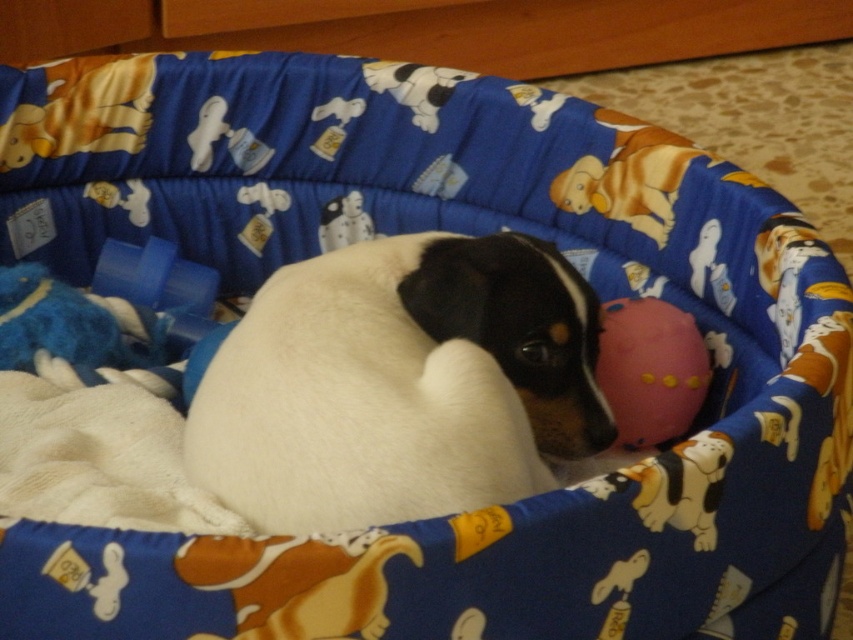
You are a pet owner who wants to ensure the safety of your dog. You notice the white fur dog at center and the pink rubber ball at center. Which object takes up more space in the pet bed?

The white fur dog at center is larger in size than the pink rubber ball at center, so the white fur dog at center takes up more space in the pet bed.

You are a pet owner who wants to place a new rectangular dog bed that is 1.5 feet wide in the same area where the white fur dog at center and the pink rubber ball at center are located. Based on their sizes, will the new bed fit comfortably without overlapping either object?

The white fur dog at center might be wider than the pink rubber ball at center. Since the new bed is 1.5 feet wide, if the dog is wider than 1.5 feet, the bed may not fit comfortably. However, if the dog is narrower, it could work. The exact width of the dog isn